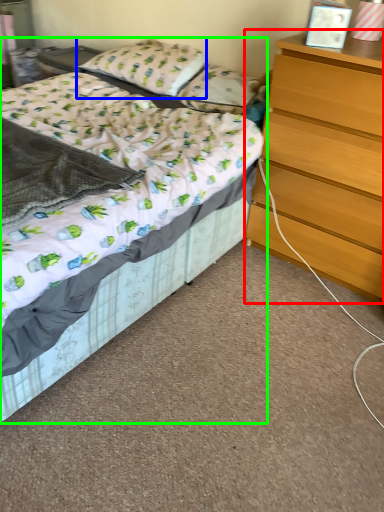
Question: Which object is the closest to the chest of drawers (highlighted by a red box)? Choose among these: pillow (highlighted by a blue box) or bed (highlighted by a green box).

Choices:
 (A) pillow
 (B) bed

Answer: (B)